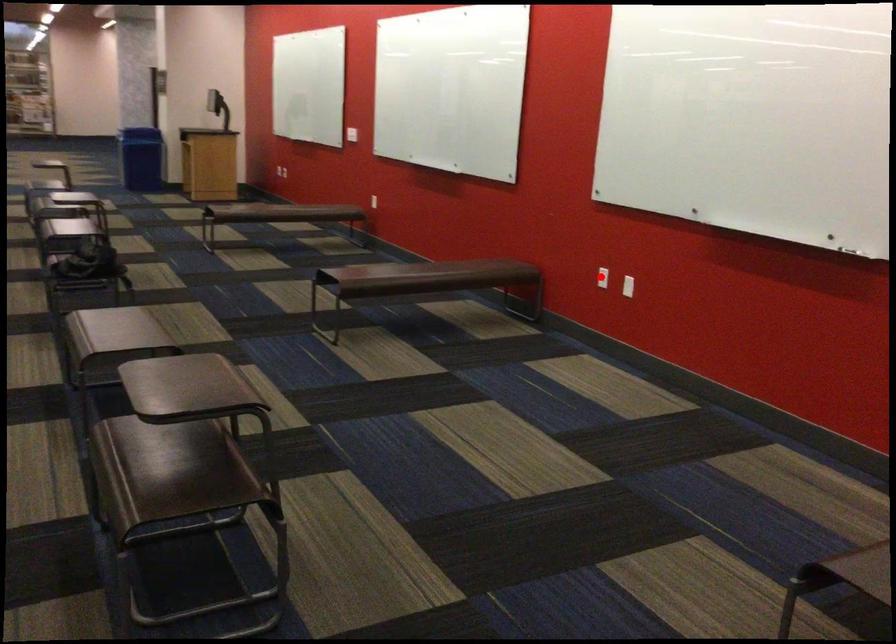
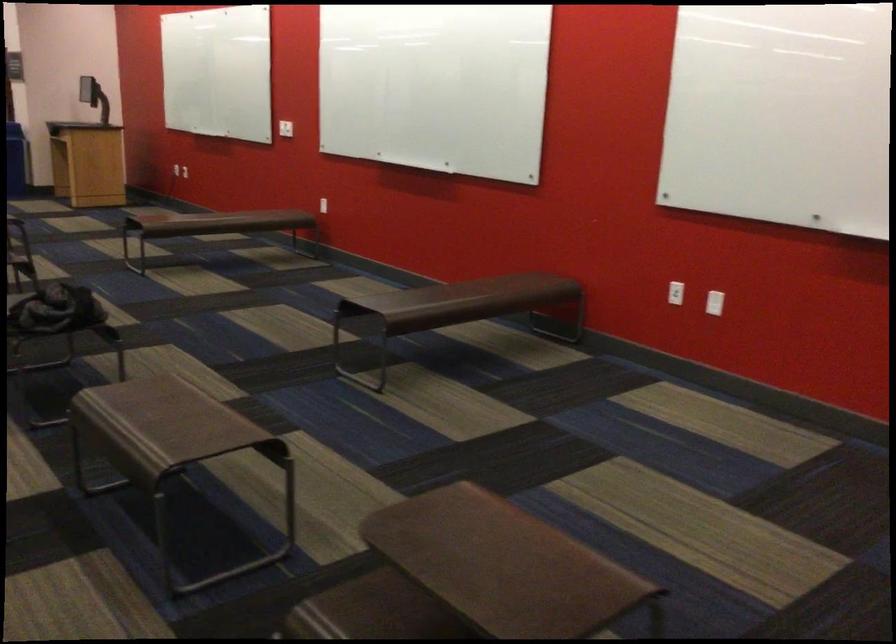
Find the pixel in the second image that matches the highlighted location in the first image.

(675, 292)